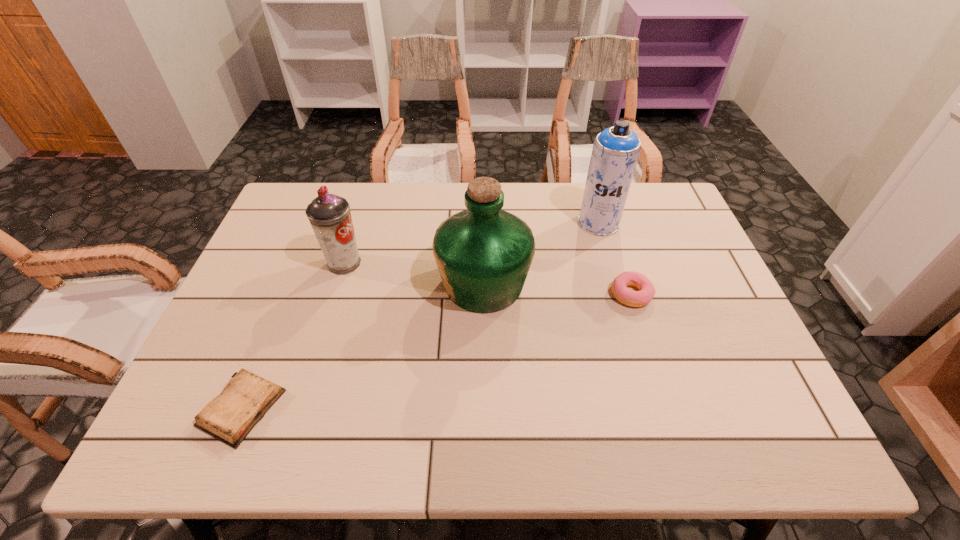
This screenshot has width=960, height=540. What are the coordinates of `free region located 0.200m on the label side of the liquor` in the screenshot? It's located at (362, 284).

I want to click on free space located on the label side of the liquor, so click(x=288, y=284).

In order to click on vacant region located on the back of the left aerosol can in this screenshot , I will do `click(354, 231)`.

The height and width of the screenshot is (540, 960). I want to click on vacant space situated on the right of the fourth tallest object, so click(701, 294).

Where is `vacant region located on the left of the shortest object`? The image size is (960, 540). vacant region located on the left of the shortest object is located at coordinates (180, 408).

This screenshot has height=540, width=960. Identify the location of object present at the far edge. (615, 152).

Locate an element on the screen. The width and height of the screenshot is (960, 540). object that is at the near edge is located at coordinates (229, 417).

Locate an element on the screen. Image resolution: width=960 pixels, height=540 pixels. object that is positioned at the left edge is located at coordinates (229, 417).

Where is `object positioned at the near left corner`? Image resolution: width=960 pixels, height=540 pixels. object positioned at the near left corner is located at coordinates (229, 417).

This screenshot has width=960, height=540. In the image, there is a desktop. In order to click on vacant space at the far edge in this screenshot , I will do `click(462, 193)`.